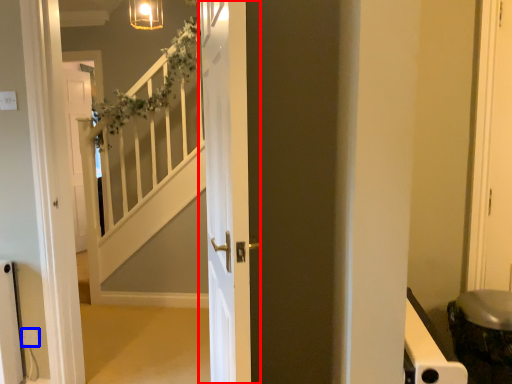
Question: Which of the following is the closest to the observer, door (highlighted by a red box) or electric outlet (highlighted by a blue box)?

Choices:
 (A) door
 (B) electric outlet

Answer: (A)